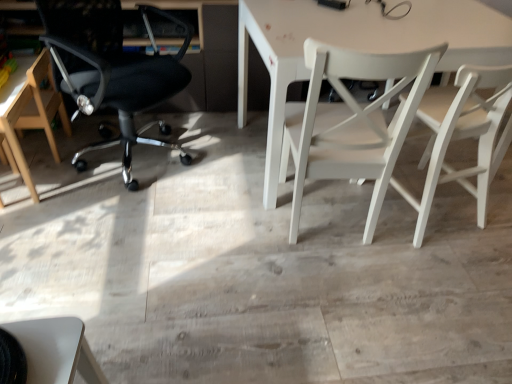
Locate an element on the screen. Image resolution: width=512 pixels, height=384 pixels. vacant area that lies between white matte chair at center, the 2th chair from the right, and black mesh office chair at left, which is counted as the 3th chair, starting from the right is located at coordinates (219, 190).